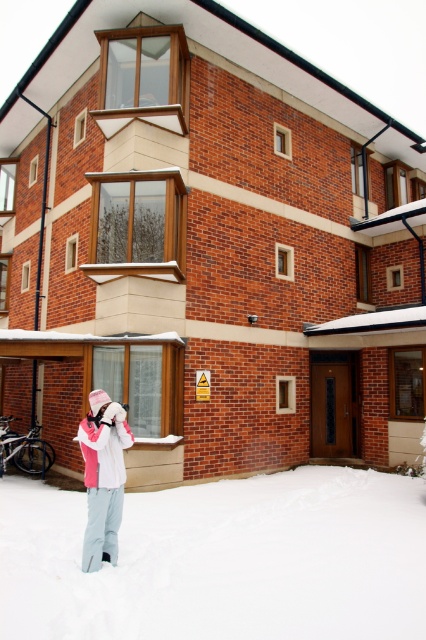
Question: Is white fluffy snow at lower center to the right of white fleece jacket at lower left from the viewer's perspective?

Choices:
 (A) yes
 (B) no

Answer: (A)

Question: Can you confirm if white fluffy snow at lower center is thinner than white fleece jacket at lower left?

Choices:
 (A) yes
 (B) no

Answer: (A)

Question: Which of the following is the closest to the observer?

Choices:
 (A) 86,429
 (B) 29,595

Answer: (B)

Question: Which point is farther to the camera?

Choices:
 (A) 103,426
 (B) 149,508

Answer: (B)

Question: Does white fluffy snow at lower center have a smaller size compared to white fleece jacket at lower left?

Choices:
 (A) no
 (B) yes

Answer: (B)